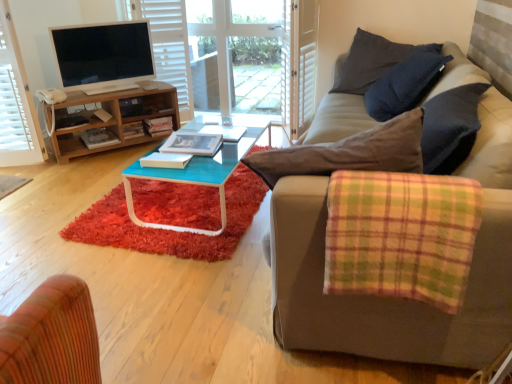
Find the location of a particular element. The image size is (512, 384). free location in front of shaggy red rug at center is located at coordinates (165, 286).